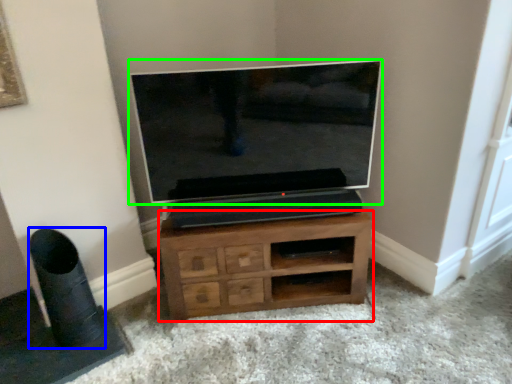
Question: Based on their relative distances, which object is farther from chest of drawers (highlighted by a red box)? Choose from speaker (highlighted by a blue box) and television (highlighted by a green box).

Choices:
 (A) speaker
 (B) television

Answer: (A)